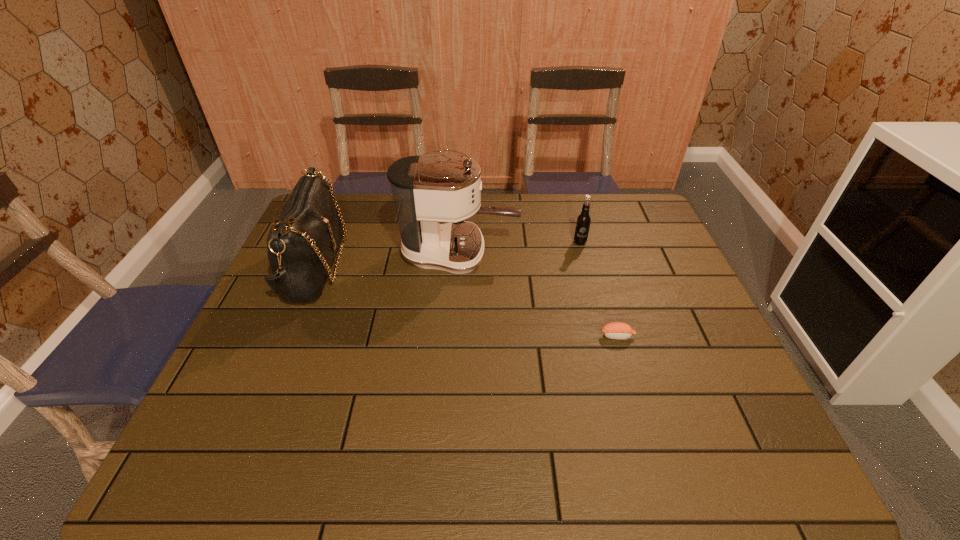
Identify the location of vacant space located 0.240m on the front of the shortest object. Image resolution: width=960 pixels, height=540 pixels. (646, 431).

This screenshot has width=960, height=540. I want to click on coffee maker at the far edge, so click(x=427, y=189).

In order to click on handbag located in the far edge section of the desktop in this screenshot , I will do `click(302, 243)`.

I want to click on object that is at the left edge, so click(x=302, y=243).

You are a GUI agent. You are given a task and a screenshot of the screen. Output one action in this format:
    pyautogui.click(x=<x>, y=<y>)
    Task: Click on the object located at the far left corner
    
    Given the screenshot: What is the action you would take?
    pyautogui.click(x=302, y=243)

Identify the location of vacant position at the far edge of the desktop. (507, 197).

Where is `vacant area at the near edge of the desktop`? Image resolution: width=960 pixels, height=540 pixels. vacant area at the near edge of the desktop is located at coordinates coord(650,438).

I want to click on vacant space at the left edge of the desktop, so click(x=239, y=375).

Where is `blank space at the right edge of the desktop`? blank space at the right edge of the desktop is located at coordinates (629, 254).

In the image, there is a desktop. Where is `free space at the far right corner`? The image size is (960, 540). free space at the far right corner is located at coordinates point(640,224).